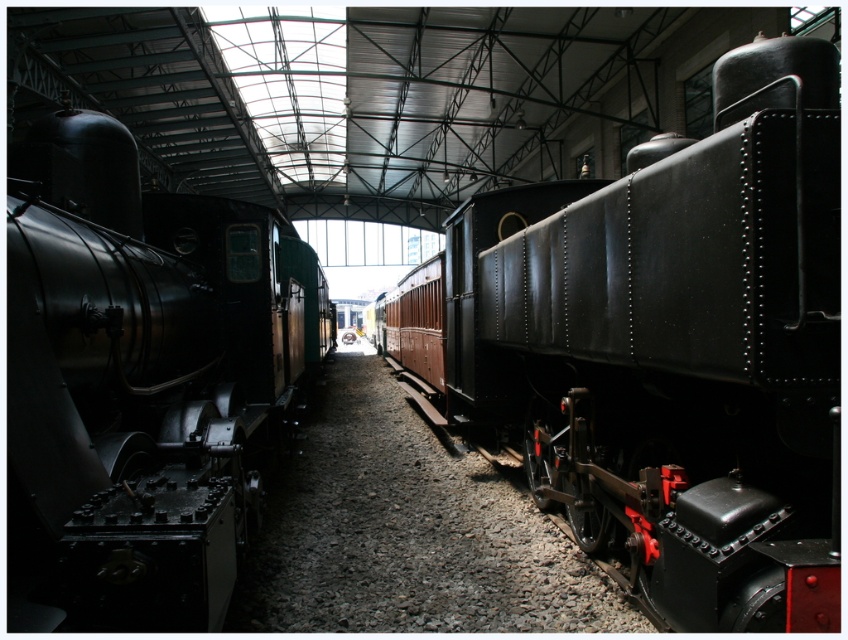
You are standing at the entrance of the train museum and want to locate the polished metal locomotive at left. According to the coordinates provided, where should you look relative to your position?

The polished metal locomotive at left is located at coordinates point [143,374], which means it is positioned to your right and slightly ahead of you.

You are a museum guide explaining the layout of the train exhibit. You mention the matte black train at center and the gray gravel at center. Which of these two has a smaller width?

The matte black train at center has a lesser width compared to the gray gravel at center.